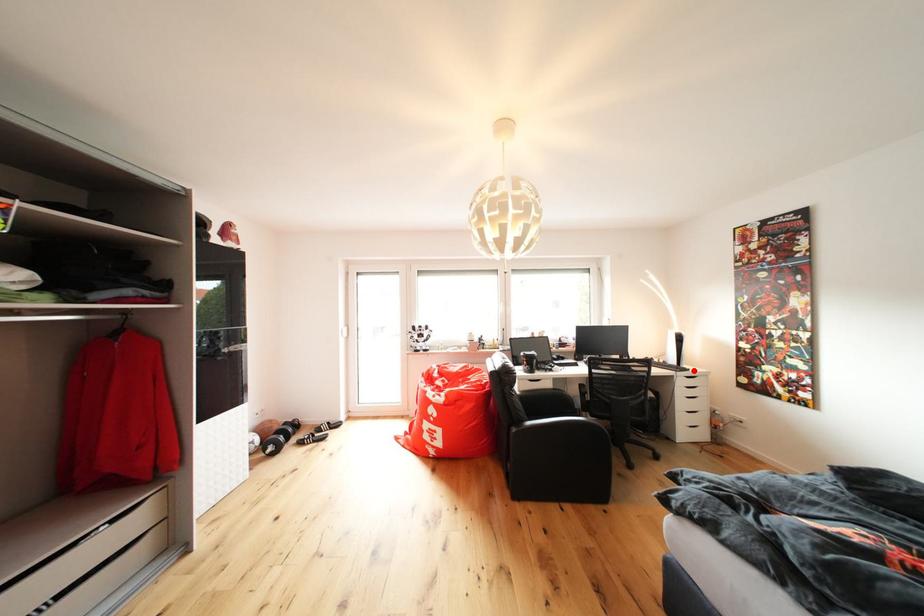
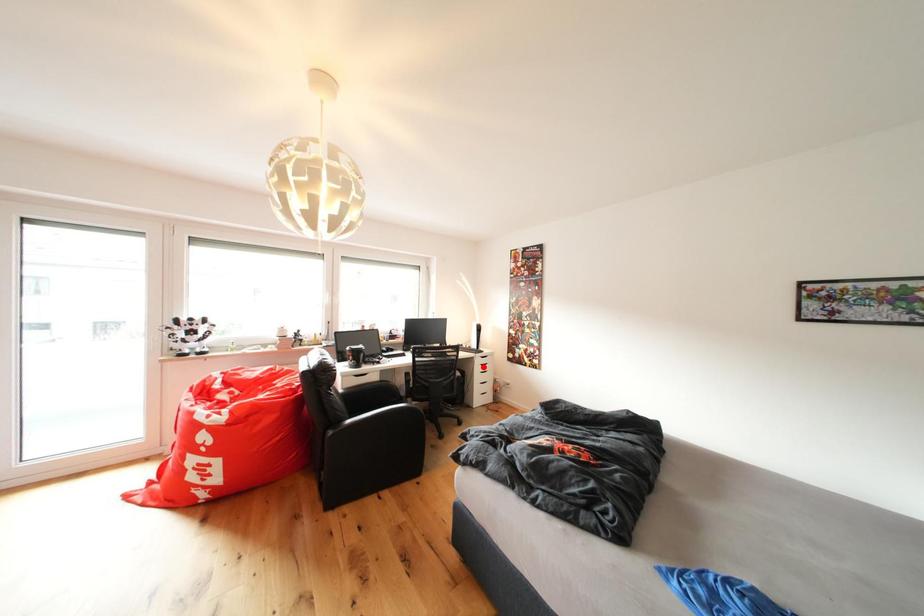
I am providing you with two images of the same scene from different viewpoints. A red point is marked on the first image and another point is marked on the second image. Are the points marked in image1 and image2 representing the same 3D position?

No